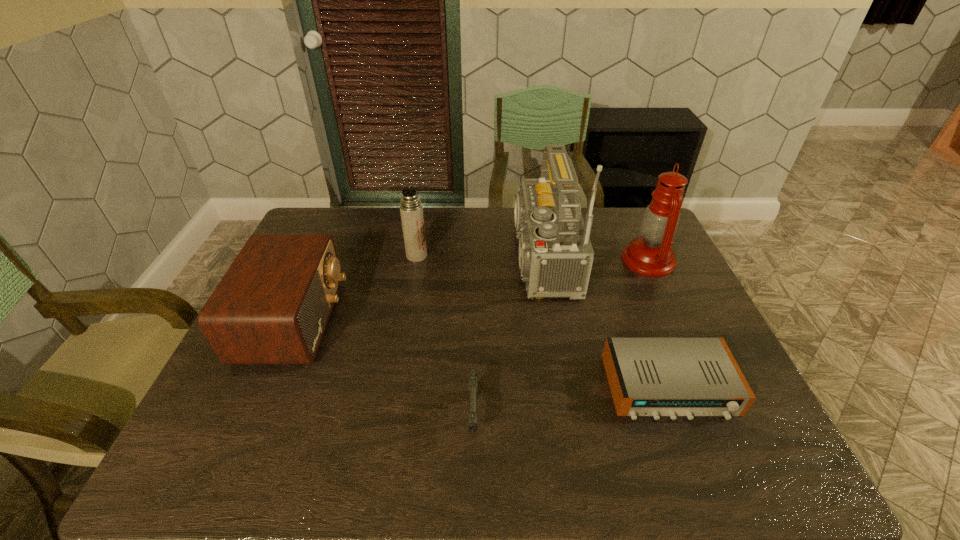
Image resolution: width=960 pixels, height=540 pixels. Find the location of `the closest radio receiver to the gun`. the closest radio receiver to the gun is located at coordinates (555, 252).

At what (x,y) coordinates should I click in order to perform the action: click on radio receiver object that ranks as the closest to the second object from left to right. Please return your answer as a coordinate pair (x, y). The image size is (960, 540). Looking at the image, I should click on (272, 306).

Find the location of a particular element. free space that satisfies the following two spatial constraints: 1. on the front-facing side of the second radio receiver from right to left; 2. in the direction the third object from left to right is aimed is located at coordinates (558, 416).

Locate an element on the screen. This screenshot has height=540, width=960. free location that satisfies the following two spatial constraints: 1. on the front side of the third tallest object; 2. on the right side of the fifth shortest object is located at coordinates (416, 260).

The width and height of the screenshot is (960, 540). Find the location of `vacant space that satisfies the following two spatial constraints: 1. on the front-facing side of the oil lamp; 2. on the right side of the tallest radio receiver`. vacant space that satisfies the following two spatial constraints: 1. on the front-facing side of the oil lamp; 2. on the right side of the tallest radio receiver is located at coordinates (535, 260).

Where is `vacant space that satisfies the following two spatial constraints: 1. on the front side of the fifth object from right to left; 2. on the front panel of the leftmost object`? This screenshot has height=540, width=960. vacant space that satisfies the following two spatial constraints: 1. on the front side of the fifth object from right to left; 2. on the front panel of the leftmost object is located at coordinates (405, 321).

In order to click on vacant region that satisfies the following two spatial constraints: 1. on the front side of the thermos bottle; 2. on the front panel of the leftmost radio receiver in this screenshot , I will do `click(405, 321)`.